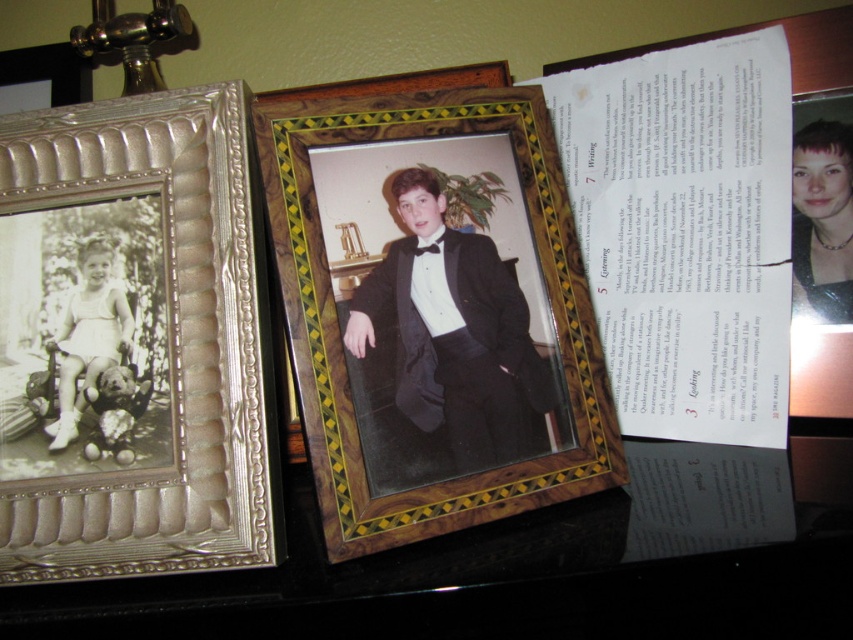
Is black glossy table at center thinner than white matte dress at left?

No.

Can you confirm if black glossy table at center is positioned above white matte dress at left?

No, black glossy table at center is not above white matte dress at left.

The image size is (853, 640). What do you see at coordinates (509, 573) in the screenshot? I see `black glossy table at center` at bounding box center [509, 573].

This screenshot has width=853, height=640. Find the location of `black glossy table at center`. black glossy table at center is located at coordinates (509, 573).

Who is positioned more to the right, black satin tuxedo at center or silver metallic photo frame at upper left?

black satin tuxedo at center

Can you confirm if black satin tuxedo at center is bigger than silver metallic photo frame at upper left?

Yes.

The height and width of the screenshot is (640, 853). Describe the element at coordinates (454, 333) in the screenshot. I see `black satin tuxedo at center` at that location.

The width and height of the screenshot is (853, 640). In order to click on black satin tuxedo at center in this screenshot , I will do [454, 333].

Can you confirm if black glossy table at center is bigger than white satin cocktail dress at left?

Correct, black glossy table at center is larger in size than white satin cocktail dress at left.

Which is more to the left, black glossy table at center or white satin cocktail dress at left?

From the viewer's perspective, white satin cocktail dress at left appears more on the left side.

Identify the location of black glossy table at center. (509, 573).

Where is `black glossy table at center`? The image size is (853, 640). black glossy table at center is located at coordinates (509, 573).